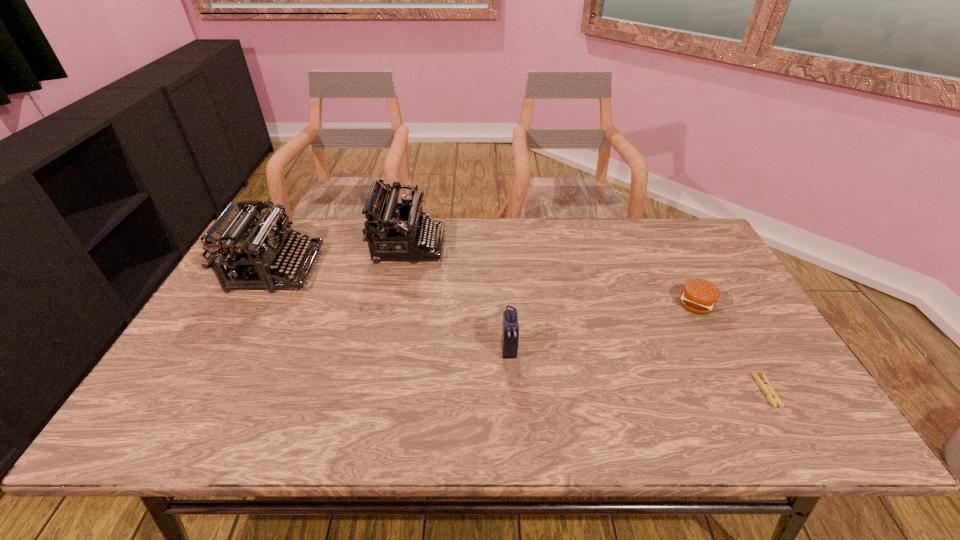
Where is `the fourth object from right to left`? The image size is (960, 540). the fourth object from right to left is located at coordinates (393, 230).

In order to click on the left typewriter in this screenshot , I will do `click(238, 239)`.

Where is `the third object from left to right`? The height and width of the screenshot is (540, 960). the third object from left to right is located at coordinates (510, 333).

What are the coordinates of `clutch bag` in the screenshot? It's located at (510, 333).

Find the location of a particular element. This screenshot has width=960, height=540. hamburger is located at coordinates (699, 296).

Where is `the nearest object`? the nearest object is located at coordinates (765, 385).

Find the location of a particular element. The width and height of the screenshot is (960, 540). clothespin is located at coordinates (765, 385).

I want to click on vacant space positioned 0.370m on the keyboard of the fourth object from right to left, so click(x=557, y=245).

Find the location of a particular element. vacant space located 0.370m on the typing side of the left typewriter is located at coordinates (437, 268).

Where is `free space located 0.050m with the zip open on the third shortest object`? This screenshot has height=540, width=960. free space located 0.050m with the zip open on the third shortest object is located at coordinates click(511, 380).